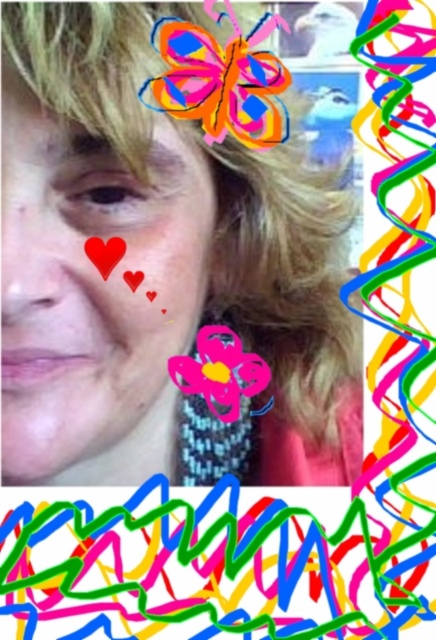
You are an artist trying to place a sticker on the exact location of the point with coordinates (221, 77) in the image. Where should you place the sticker?

The point with coordinates (221, 77) is located on the multicolored paper butterfly at upper center, so you should place the sticker on the multicolored paper butterfly at upper center.

You are a graphic designer working on an image editing project. You need to place a new sticker exactly 0.05 units to the right of the multicolored paper butterfly at upper center. What are the coordinates where you should place the new sticker?

The multicolored paper butterfly at upper center is at point [221,77]. Adding 0.05 to the x coordinate gives 0.173, so the new sticker should be placed at coordinates [221,109].

You are designing a digital frame for this selfie and need to ensure the pink matte heart at upper left and the matte red heart at upper left are both visible. Since they are both at the upper left, which one should you position higher to avoid overlap?

The pink matte heart at upper left is taller than the matte red heart at upper left, so positioning the pink matte heart higher would prevent overlap as it occupies more vertical space.